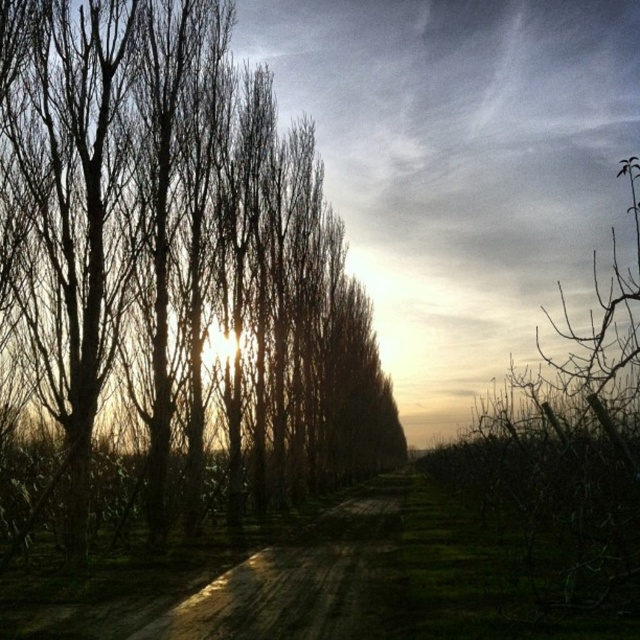
You are a hiker who wants to take a photo of the bare branches at center and the dull brown dirt track at center. Which object will appear bigger in your camera viewfinder?

The bare branches at center will appear bigger in your camera viewfinder since it has a larger size compared to the dull brown dirt track at center.

You are a hiker walking along the dirt path in the rural area shown. You notice the bare branches at center and the dull brown dirt track at center. Which object is closer to you as you walk forward?

The bare branches at center are closer to you than the dull brown dirt track at center because the dirt track is positioned behind the branches.

You are standing on the dirt path in the rural scene. You see two points marked on the path ahead of you. The first point is at coordinates point (221, 124) and the second is at point (250, 627). Which point is closer to your current position?

Point (221, 124) is closer to your current position because it is further to the viewer than point (250, 627), meaning it is nearer to you on the path.